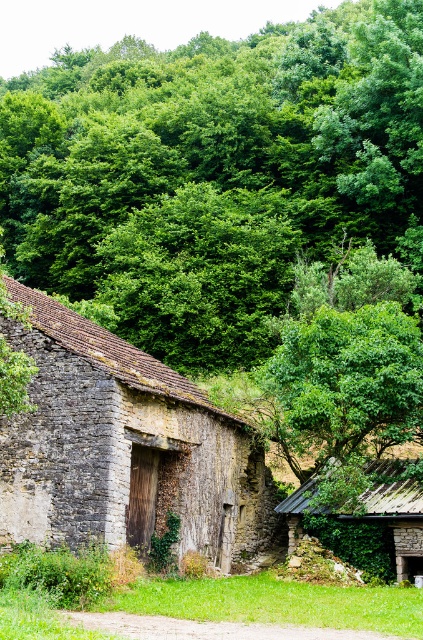
Is stone textured hut at left taller than rusty metal hut at center?

Correct, stone textured hut at left is much taller as rusty metal hut at center.

Who is lower down, stone textured hut at left or rusty metal hut at center?

rusty metal hut at center is lower down.

Between point (14, 424) and point (376, 536), which one is positioned behind?

Point (376, 536)

Find the location of `stone textured hut at left`. stone textured hut at left is located at coordinates (123, 449).

Does green leafy tree at upper center come behind stone textured hut at left?

That is True.

Is green leafy tree at upper center shorter than stone textured hut at left?

In fact, green leafy tree at upper center may be taller than stone textured hut at left.

Locate an element on the screen. This screenshot has width=423, height=640. green leafy tree at upper center is located at coordinates (214, 172).

Image resolution: width=423 pixels, height=640 pixels. I want to click on green leafy tree at upper center, so click(x=214, y=172).

What are the coordinates of `green leafy tree at upper center` in the screenshot? It's located at (214, 172).